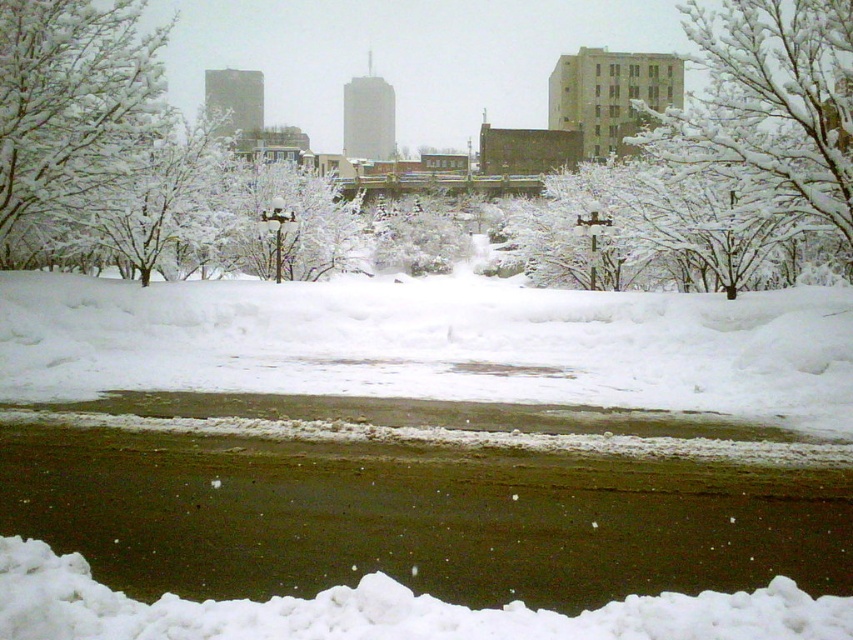
You are an urban planner assessing the park layout. You need to determine which object occupies more horizontal space in the image between the white frosty tree at upper center and the white frosty branches at upper left. Which one is wider?

The white frosty tree at upper center is wider than the white frosty branches at upper left because its width surpasses the latter.